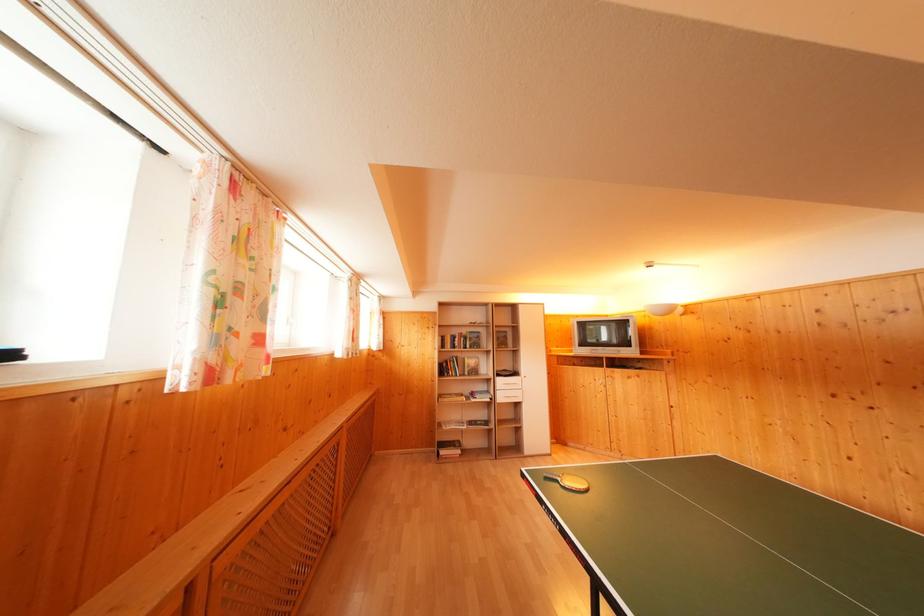
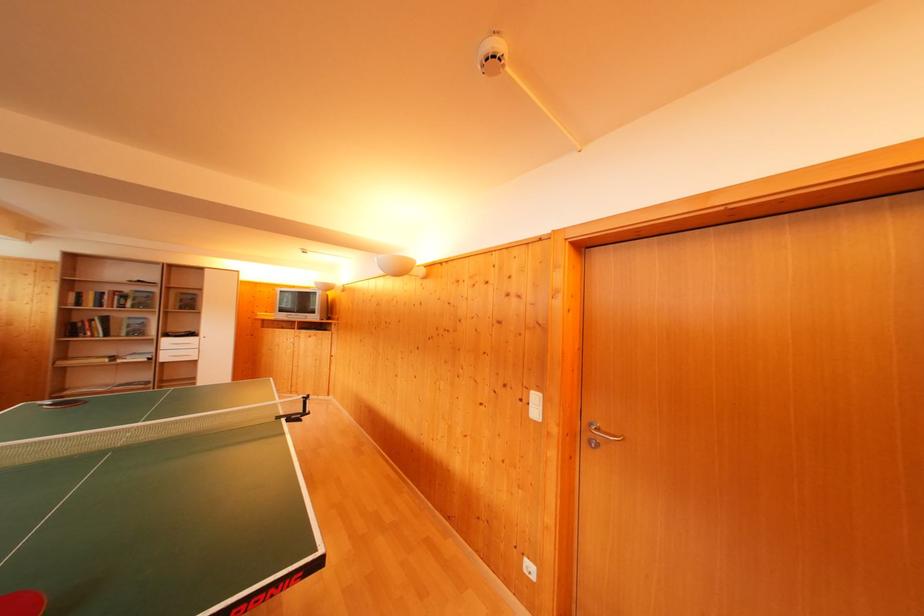
Find the pixel in the second image that matches point 459,337 in the first image.

(112, 294)